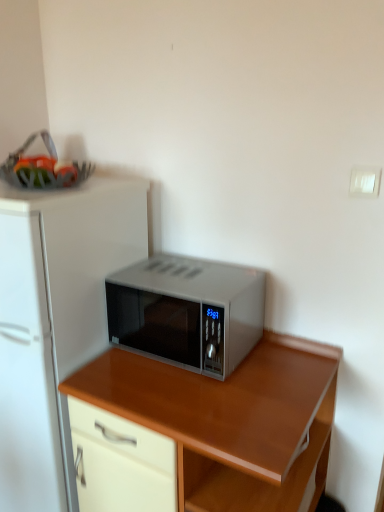
Question: Is white matte refrigerator at center aimed at wooden desk at center?

Choices:
 (A) no
 (B) yes

Answer: (A)

Question: From the image's perspective, is white matte refrigerator at center located beneath wooden desk at center?

Choices:
 (A) no
 (B) yes

Answer: (A)

Question: Does white matte refrigerator at center have a lesser width compared to wooden desk at center?

Choices:
 (A) no
 (B) yes

Answer: (A)

Question: From a real-world perspective, is white matte refrigerator at center on top of wooden desk at center?

Choices:
 (A) yes
 (B) no

Answer: (A)

Question: Can you confirm if white matte refrigerator at center is taller than wooden desk at center?

Choices:
 (A) yes
 (B) no

Answer: (A)

Question: From their relative heights in the image, would you say satin silver microwave at center is taller or shorter than wooden desk at center?

Choices:
 (A) short
 (B) tall

Answer: (A)

Question: From the image's perspective, is satin silver microwave at center positioned above or below wooden desk at center?

Choices:
 (A) above
 (B) below

Answer: (A)

Question: Considering their positions, is satin silver microwave at center located in front of or behind wooden desk at center?

Choices:
 (A) behind
 (B) front

Answer: (A)

Question: From a real-world perspective, is satin silver microwave at center physically located above or below wooden desk at center?

Choices:
 (A) below
 (B) above

Answer: (B)

Question: Based on their sizes in the image, would you say wooden desk at center is bigger or smaller than white matte refrigerator at center?

Choices:
 (A) small
 (B) big

Answer: (A)

Question: Which is correct: wooden desk at center is inside white matte refrigerator at center, or outside of it?

Choices:
 (A) outside
 (B) inside

Answer: (A)

Question: Is wooden desk at center in front of or behind white matte refrigerator at center in the image?

Choices:
 (A) behind
 (B) front

Answer: (B)

Question: Looking at their shapes, would you say wooden desk at center is wider or thinner than white matte refrigerator at center?

Choices:
 (A) thin
 (B) wide

Answer: (A)

Question: From a real-world perspective, is white matte refrigerator at center physically located above or below wooden desk at center?

Choices:
 (A) above
 (B) below

Answer: (A)

Question: From the image's perspective, is white matte refrigerator at center positioned above or below wooden desk at center?

Choices:
 (A) below
 (B) above

Answer: (B)